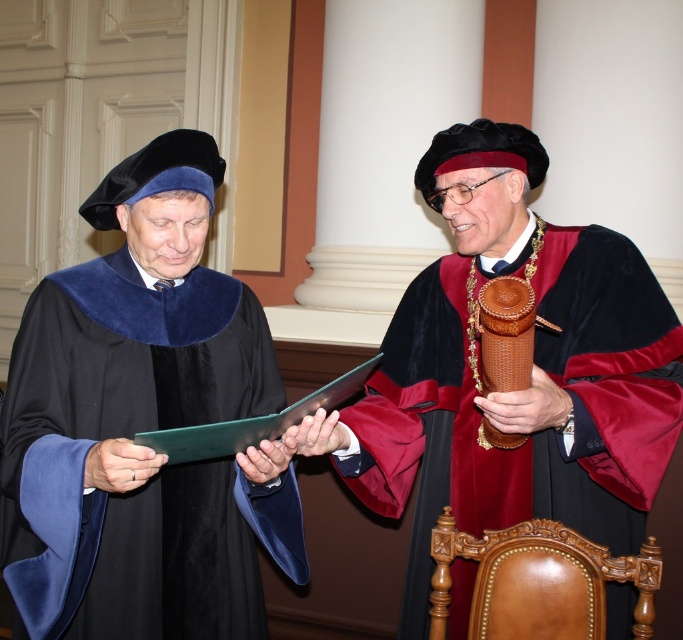
Based on the photo, you are an event photographer at the ceremony. You need to capture a photo of the velvet black robe at left and the other person holding the book. How far apart are the two people?

The two people are 1.67 meters apart.

You are an attendee at this event and want to take a photo of the velvet black robe at left and the velvet maroon and black gown at center. Which one should you focus on first to ensure both are in the frame?

You should focus on the velvet black robe at left first because it is closer to you than the velvet maroon and black gown at center, ensuring both are in the frame.

You are standing at the entrance of the hall and see two points marked in the scene. Which point, point (197,508) or point (447,362), is closer to you?

Point (197,508) is closer to you because it is in front of point (447,362).